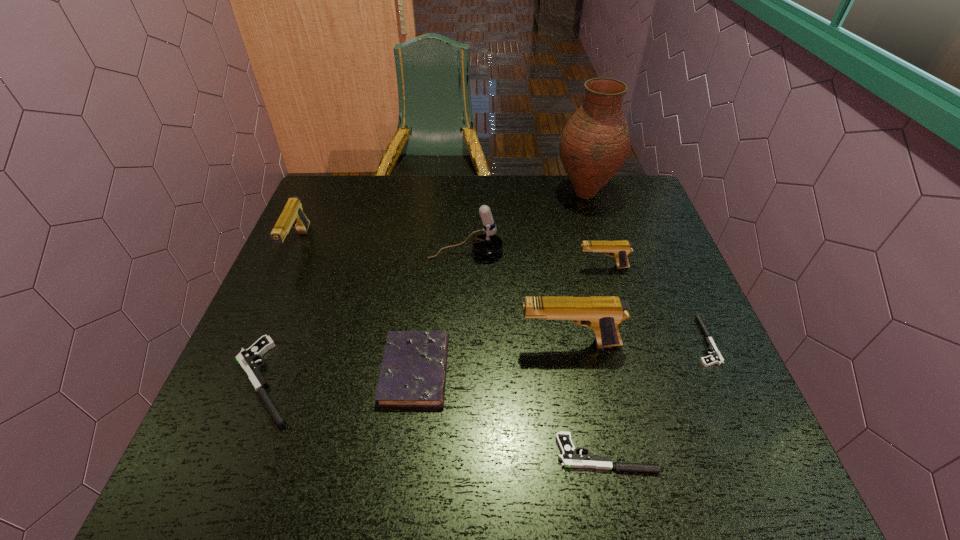
Identify the location of the tallest object. (595, 143).

This screenshot has width=960, height=540. In order to click on the farthest object in this screenshot , I will do `click(595, 143)`.

Locate an element on the screen. This screenshot has height=540, width=960. white microphone is located at coordinates (488, 244).

The image size is (960, 540). In order to click on the biggest tan pistol in this screenshot , I will do `click(603, 314)`.

You are a GUI agent. You are given a task and a screenshot of the screen. Output one action in this format:
    pyautogui.click(x=<x>, y=<y>)
    Task: Click on the nearest tan pistol
    The height and width of the screenshot is (540, 960).
    Given the screenshot: What is the action you would take?
    pyautogui.click(x=603, y=314)

This screenshot has height=540, width=960. In order to click on the fourth tallest object in this screenshot , I will do `click(292, 216)`.

The image size is (960, 540). In order to click on the fifth shortest pistol in this screenshot , I will do `click(292, 216)`.

Locate an element on the screen. The width and height of the screenshot is (960, 540). the fifth tallest object is located at coordinates (619, 249).

I want to click on the third tallest pistol, so click(x=619, y=249).

Find the location of a particular element. the fourth shortest object is located at coordinates (413, 373).